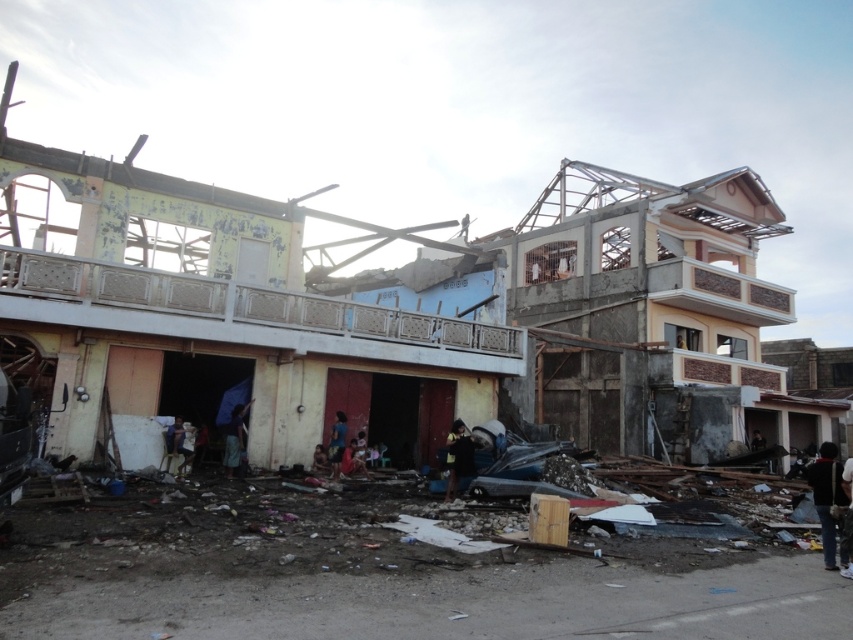
Can you confirm if black fabric bag at lower right is thinner than blue fabric at lower center?

Incorrect, black fabric bag at lower right's width is not less than blue fabric at lower center's.

Who is more forward, (828,509) or (233,448)?

Point (828,509) is in front.

The image size is (853, 640). I want to click on black fabric bag at lower right, so click(827, 497).

Where is `blue fabric at center`? The image size is (853, 640). blue fabric at center is located at coordinates (337, 444).

Based on the photo, which is above, blue fabric at center or red fabric cloth at center?

blue fabric at center is above.

Which is in front, point (334, 474) or point (347, 445)?

Point (334, 474) is more forward.

Image resolution: width=853 pixels, height=640 pixels. Find the location of `blue fabric at center`. blue fabric at center is located at coordinates (337, 444).

Does black fabric at center come in front of blue fabric at center?

Yes.

Can you confirm if black fabric at center is bigger than blue fabric at center?

Incorrect, black fabric at center is not larger than blue fabric at center.

Locate an element on the screen. black fabric at center is located at coordinates (457, 460).

Image resolution: width=853 pixels, height=640 pixels. Find the location of `black fabric at center`. black fabric at center is located at coordinates (457, 460).